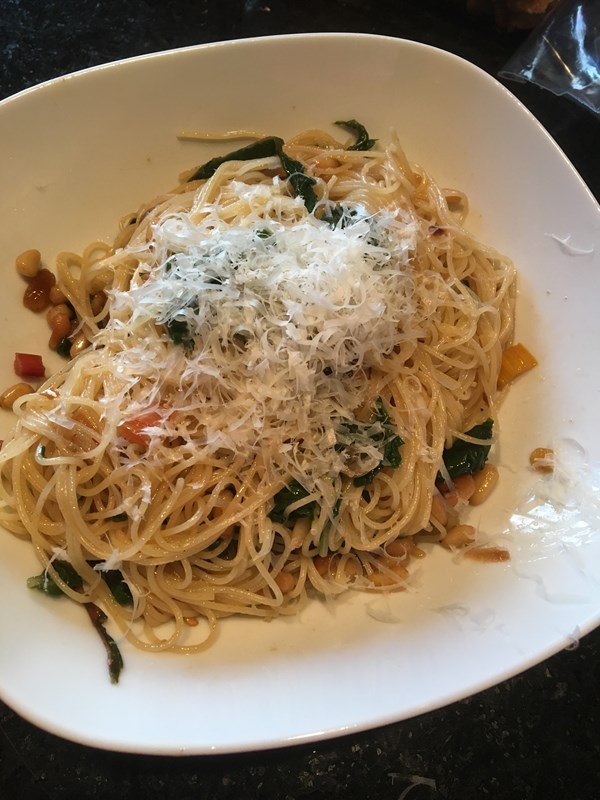
The width and height of the screenshot is (600, 800). I want to click on plate, so click(x=342, y=646).